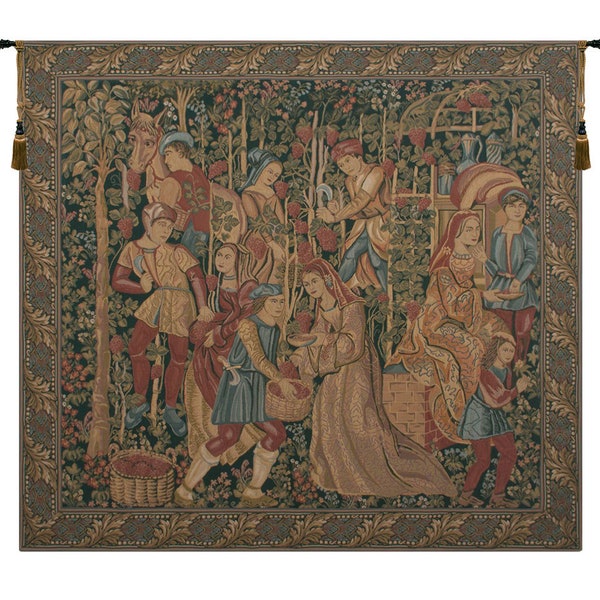
Locate an element on the screen. This screenshot has height=600, width=600. brick wall is located at coordinates (417, 414).